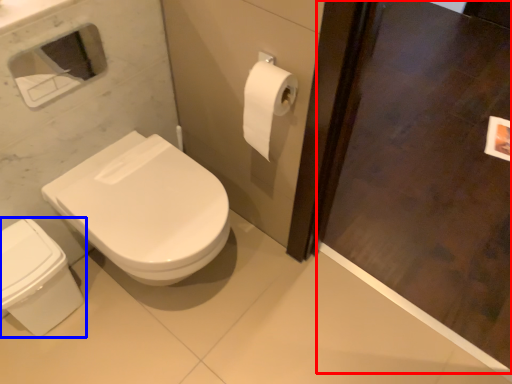
Question: Which object is further to the camera taking this photo, screen door (highlighted by a red box) or bidet (highlighted by a blue box)?

Choices:
 (A) screen door
 (B) bidet

Answer: (B)